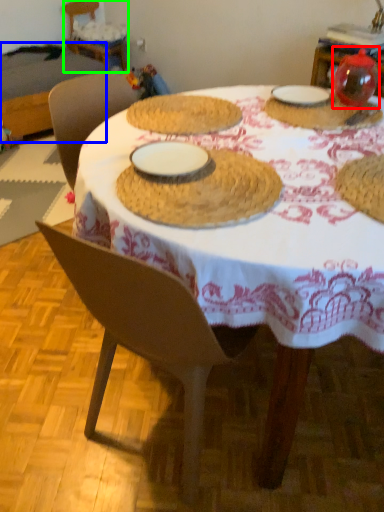
Question: Which is farther away from tableware (highlighted by a red box)? table (highlighted by a blue box) or chair (highlighted by a green box)?

Choices:
 (A) table
 (B) chair

Answer: (B)